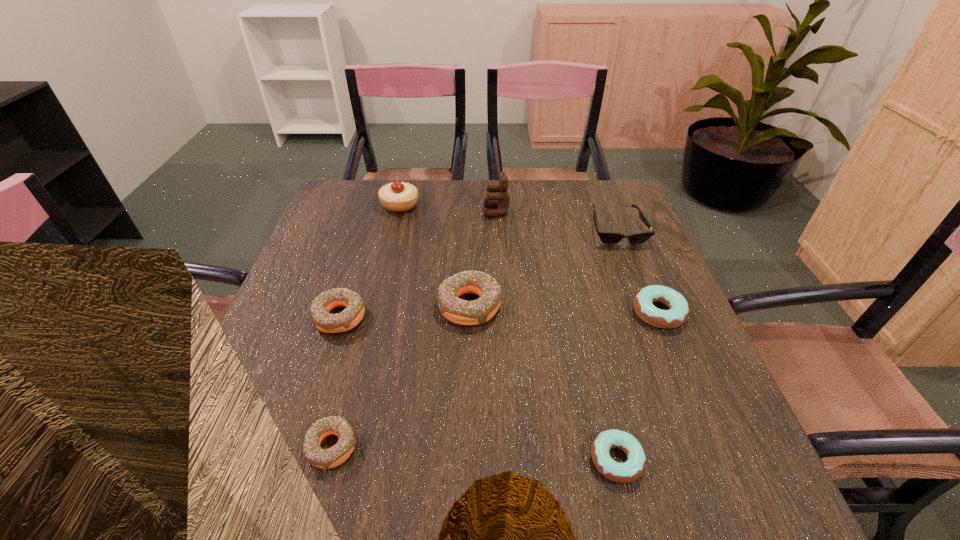
Identify the location of object that is at the far right corner. The height and width of the screenshot is (540, 960). [606, 237].

This screenshot has height=540, width=960. In the image, there is a desktop. In order to click on vacant space at the far edge in this screenshot , I will do `click(556, 187)`.

Locate an element on the screen. This screenshot has width=960, height=540. vacant space at the left edge of the desktop is located at coordinates (272, 403).

Locate an element on the screen. Image resolution: width=960 pixels, height=540 pixels. free spot at the right edge of the desktop is located at coordinates (641, 247).

You are a GUI agent. You are given a task and a screenshot of the screen. Output one action in this format:
    pyautogui.click(x=<x>, y=<y>)
    Task: Click on the free space at the far right corner of the desktop
    The image size is (960, 540).
    Given the screenshot: What is the action you would take?
    pyautogui.click(x=624, y=194)

In the image, there is a desktop. Where is `vacant space at the near right corner`? The width and height of the screenshot is (960, 540). vacant space at the near right corner is located at coordinates (671, 510).

Where is `free spot between the teddy bear and the sunglasses`? free spot between the teddy bear and the sunglasses is located at coordinates (557, 220).

Find the location of a particular element. The height and width of the screenshot is (540, 960). vacant space that's between the nearest chocolate doughnut and the pastry is located at coordinates (366, 326).

Where is `free point between the right blue doughnut and the smallest chocolate doughnut`? The width and height of the screenshot is (960, 540). free point between the right blue doughnut and the smallest chocolate doughnut is located at coordinates (495, 380).

Find the location of a particular element. vacant space that is in between the sunglasses and the nearer blue doughnut is located at coordinates (616, 345).